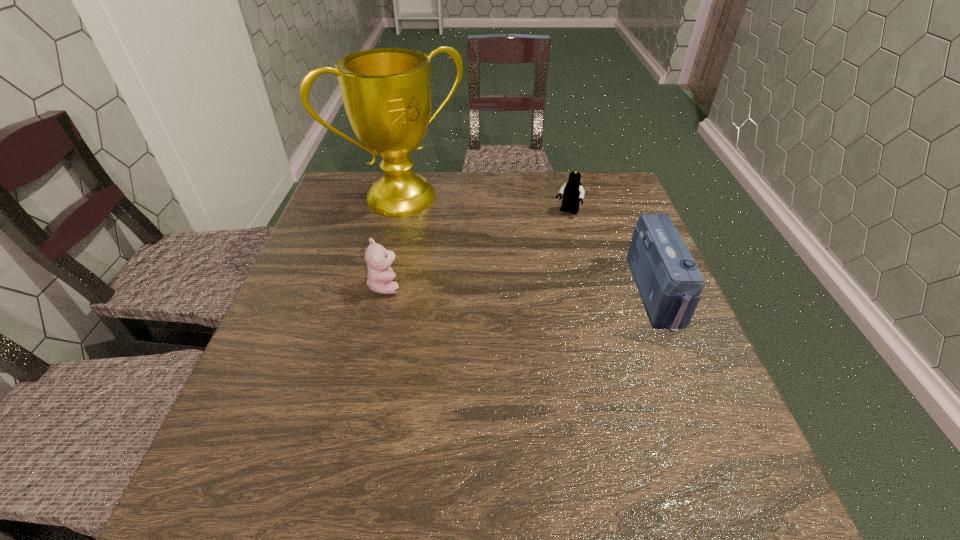
Identify the location of free location that satisfies the following two spatial constraints: 1. on the front side of the third object from left to right; 2. on the lens of the camera. Image resolution: width=960 pixels, height=540 pixels. pyautogui.click(x=588, y=293).

I want to click on vacant point that satisfies the following two spatial constraints: 1. on the front side of the camera; 2. on the lens of the award, so pos(381,293).

Where is `free point that satisfies the following two spatial constraints: 1. on the front side of the rightmost object; 2. on the lens of the second object from right to left`? The width and height of the screenshot is (960, 540). free point that satisfies the following two spatial constraints: 1. on the front side of the rightmost object; 2. on the lens of the second object from right to left is located at coordinates (588, 293).